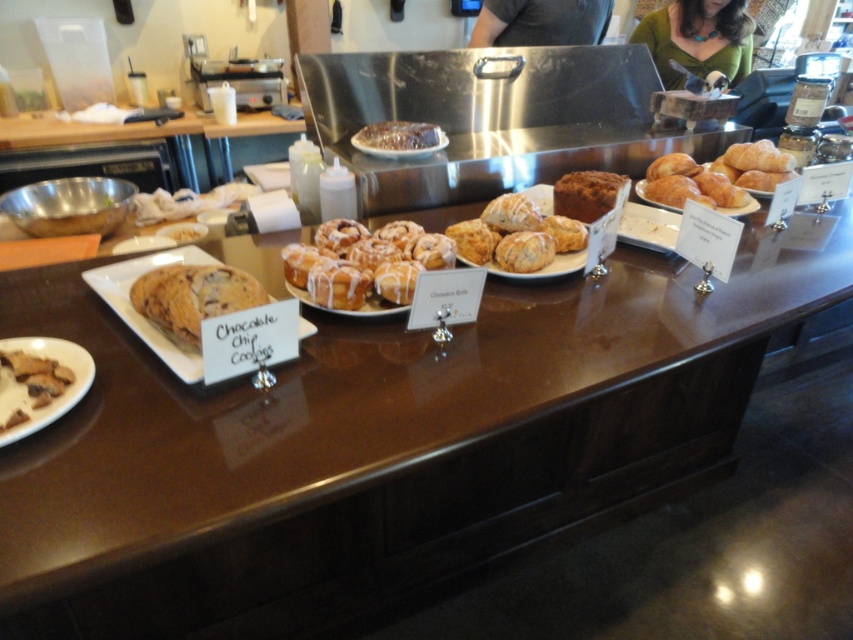
Is glazed doughnut at center behind glazed pastry at center?

No, it is not.

Does point (352, 262) come in front of point (579, 260)?

Yes, it is in front of point (579, 260).

Where is `glazed doughnut at center`? glazed doughnut at center is located at coordinates (364, 262).

Is glazed doughnut at center bigger than dark gray shirt at upper center?

Incorrect, glazed doughnut at center is not larger than dark gray shirt at upper center.

Locate an element on the screen. Image resolution: width=853 pixels, height=640 pixels. glazed doughnut at center is located at coordinates (364, 262).

Can you confirm if glazed doughnut at center is positioned to the right of shiny chocolate cake at center?

In fact, glazed doughnut at center is to the left of shiny chocolate cake at center.

Which is behind, point (378, 292) or point (437, 140)?

Point (437, 140)

Does point (357, 292) come farther from viewer compared to point (392, 131)?

No, it is not.

In order to click on glazed doughnut at center in this screenshot , I will do `click(364, 262)`.